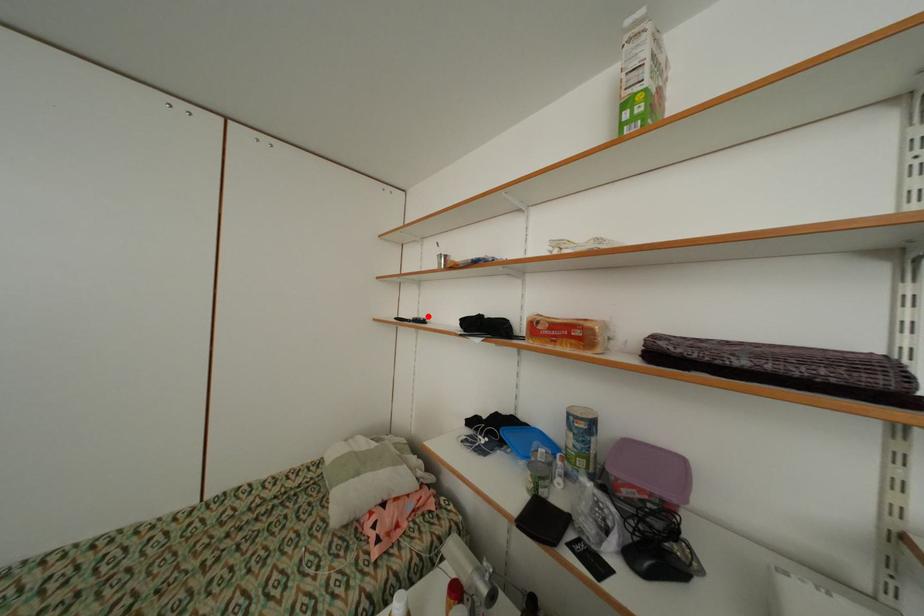
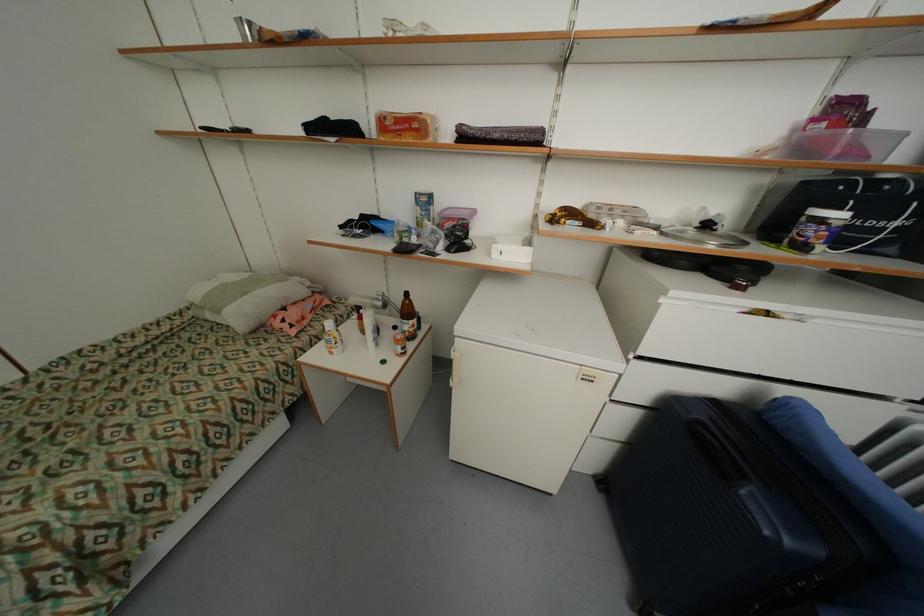
The point at the highlighted location is marked in the first image. Where is the corresponding point in the second image?

(248, 128)